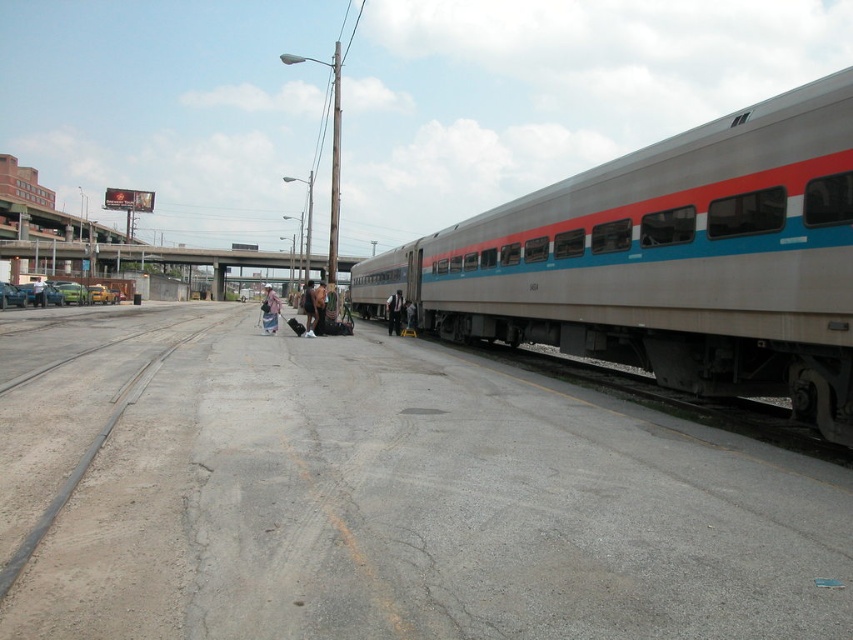
Question: Which of these objects is positioned farthest from the silver metallic train at right?

Choices:
 (A) light brown leather jacket at center
 (B) dark brown leather jacket at center
 (C) denim jacket at center

Answer: (C)

Question: Among these objects, which one is farthest from the camera?

Choices:
 (A) light brown leather jacket at center
 (B) denim jacket at center

Answer: (A)

Question: Which of the following is the farthest from the observer?

Choices:
 (A) (396, 333)
 (B) (276, 316)

Answer: (A)

Question: Is light brown leather jacket at center wider than dark brown leather jacket at center?

Choices:
 (A) no
 (B) yes

Answer: (A)

Question: Can you confirm if silver metallic train at right is positioned above dark brown leather jacket at center?

Choices:
 (A) no
 (B) yes

Answer: (B)

Question: In this image, where is silver metallic train at right located relative to denim jacket at center?

Choices:
 (A) left
 (B) right

Answer: (B)